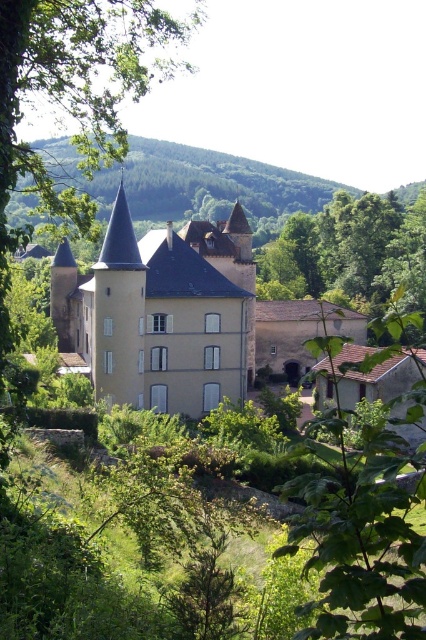
Can you confirm if beige stone castle at center is shorter than green leafy tree at center?

Correct, beige stone castle at center is not as tall as green leafy tree at center.

Who is positioned more to the right, beige stone castle at center or green leafy tree at center?

green leafy tree at center is more to the right.

Find the location of a particular element. The width and height of the screenshot is (426, 640). beige stone castle at center is located at coordinates 161,312.